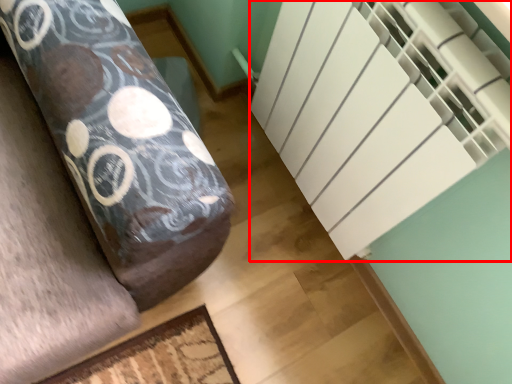
Question: From the image's perspective, what is the correct spatial positioning of stairwell (annotated by the red box) in reference to furniture?

Choices:
 (A) above
 (B) below

Answer: (A)